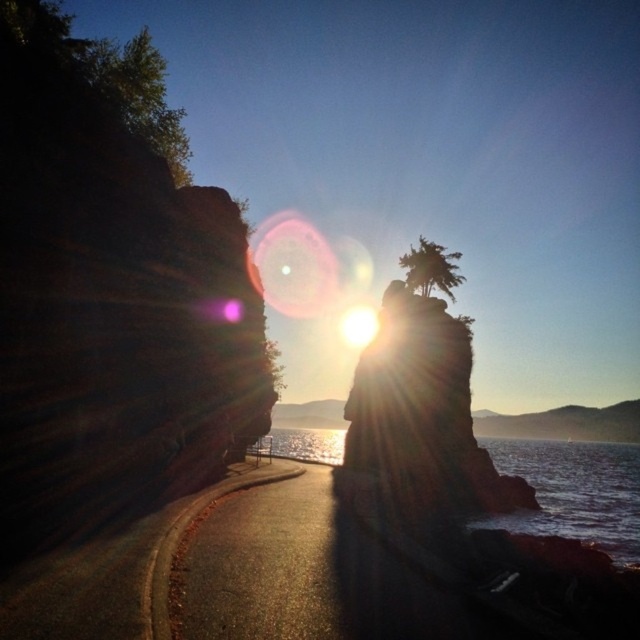
Question: Where is translucent glass water at center located in relation to bright white light at center in the image?

Choices:
 (A) above
 (B) below

Answer: (B)

Question: Does rustic stone rock formation at center appear on the right side of bright white light at center?

Choices:
 (A) yes
 (B) no

Answer: (B)

Question: Which point is farther to the camera?

Choices:
 (A) (464, 508)
 (B) (531, 465)
 (C) (353, 307)

Answer: (C)

Question: Which of the following is the closest to the observer?

Choices:
 (A) bright white light at center
 (B) translucent glass water at center

Answer: (B)

Question: Which point is farther to the camera?

Choices:
 (A) translucent glass water at center
 (B) rustic stone rock formation at center
 (C) bright white light at center

Answer: (C)

Question: Does rustic stone rock formation at center have a lesser width compared to bright white light at center?

Choices:
 (A) yes
 (B) no

Answer: (A)